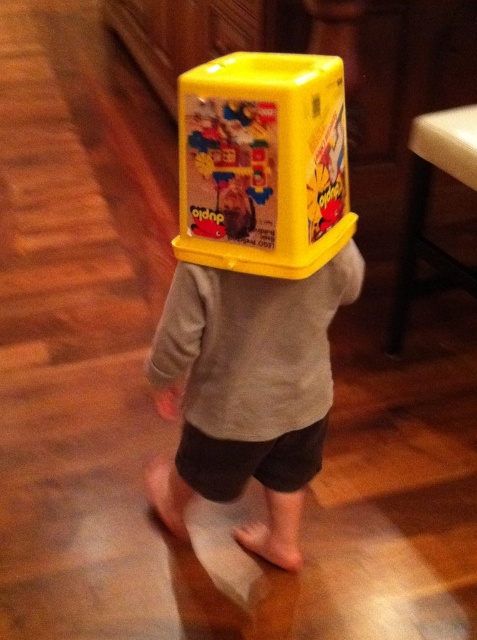
Question: Can you confirm if yellow plastic container at back is bigger than white plastic stool at lower right?

Choices:
 (A) no
 (B) yes

Answer: (A)

Question: Which point is farther from the camera taking this photo?

Choices:
 (A) (415, 285)
 (B) (241, 180)
 (C) (324, 339)

Answer: (A)

Question: Is yellow plastic container at back positioned at the back of white plastic stool at lower right?

Choices:
 (A) no
 (B) yes

Answer: (A)

Question: Which point is farther from the camera taking this photo?

Choices:
 (A) (198, 326)
 (B) (187, 205)

Answer: (A)

Question: Can you confirm if yellow plastic toy at center is wider than white plastic stool at lower right?

Choices:
 (A) no
 (B) yes

Answer: (A)

Question: Which point is farther to the camera?

Choices:
 (A) yellow plastic toy at center
 (B) white plastic stool at lower right
 (C) yellow plastic container at back

Answer: (B)